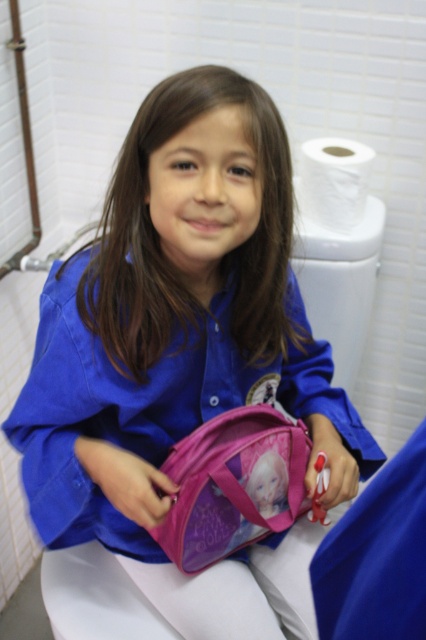
You are standing in a public restroom and see the pink fabric scrub at lower right. If you want to reach it without moving your feet, can you do so?

The pink fabric scrub at lower right is 19.91 inches away from the viewer, so yes, you can reach it without moving your feet since that distance is within typical arm reach.

You are a photographer taking a picture of the pink fabric backpack at lower center and the white matte toilet paper at upper right. Which object is located to the left of the other?

The pink fabric backpack at lower center is positioned on the left side of white matte toilet paper at upper right.

You are a nurse in a hospital room and see the pink fabric backpack at lower center and the pink fabric scrub at lower right. Which item is closer to you?

The pink fabric backpack at lower center is closer to you because it is further to the viewer than the pink fabric scrub at lower right.